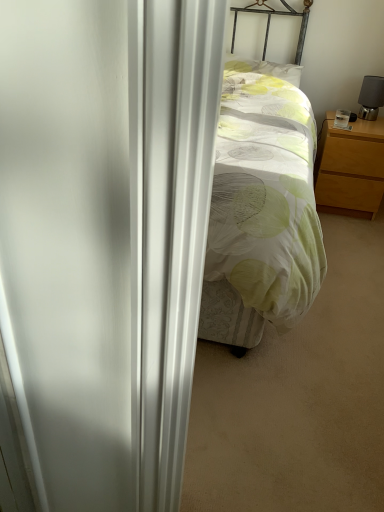
Question: Is black matte table lamp at right behind light wood/finish nightstand at right?

Choices:
 (A) no
 (B) yes

Answer: (B)

Question: Is black matte table lamp at right taller than light wood/finish nightstand at right?

Choices:
 (A) yes
 (B) no

Answer: (B)

Question: Is light wood/finish nightstand at right located within black matte table lamp at right?

Choices:
 (A) no
 (B) yes

Answer: (A)

Question: Is black matte table lamp at right to the right of light wood/finish nightstand at right from the viewer's perspective?

Choices:
 (A) no
 (B) yes

Answer: (B)

Question: Is black matte table lamp at right completely or partially outside of light wood/finish nightstand at right?

Choices:
 (A) yes
 (B) no

Answer: (A)

Question: From the image's perspective, is black matte table lamp at right located above or below light green fabric pillow at center?

Choices:
 (A) above
 (B) below

Answer: (B)

Question: Relative to light green fabric pillow at center, is black matte table lamp at right in front or behind?

Choices:
 (A) behind
 (B) front

Answer: (A)

Question: Is black matte table lamp at right bigger or smaller than light green fabric pillow at center?

Choices:
 (A) big
 (B) small

Answer: (B)

Question: In the image, is black matte table lamp at right on the left side or the right side of light green fabric pillow at center?

Choices:
 (A) right
 (B) left

Answer: (A)

Question: Looking at their shapes, would you say light wood/finish nightstand at right is wider or thinner than light green fabric pillow at center?

Choices:
 (A) thin
 (B) wide

Answer: (B)

Question: Based on their positions, is light wood/finish nightstand at right located to the left or right of light green fabric pillow at center?

Choices:
 (A) right
 (B) left

Answer: (A)

Question: Based on their sizes in the image, would you say light wood/finish nightstand at right is bigger or smaller than light green fabric pillow at center?

Choices:
 (A) big
 (B) small

Answer: (A)

Question: Would you say light wood/finish nightstand at right is inside or outside light green fabric pillow at center?

Choices:
 (A) inside
 (B) outside

Answer: (B)

Question: Is light wood/finish nightstand at right wider or thinner than black matte table lamp at right?

Choices:
 (A) wide
 (B) thin

Answer: (A)

Question: From a real-world perspective, is light wood/finish nightstand at right physically located above or below black matte table lamp at right?

Choices:
 (A) below
 (B) above

Answer: (A)